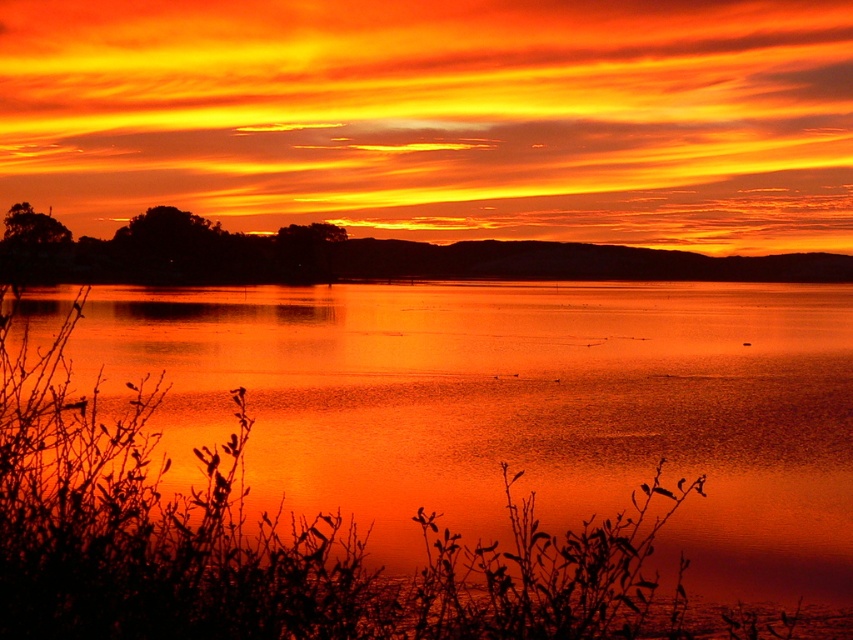
Question: In this image, where is matte orange water at center located relative to matte orange sky at center?

Choices:
 (A) right
 (B) left

Answer: (A)

Question: Is matte orange water at center closer to the viewer compared to matte orange sky at center?

Choices:
 (A) no
 (B) yes

Answer: (B)

Question: Among these points, which one is farthest from the camera?

Choices:
 (A) (134, 536)
 (B) (491, 248)

Answer: (B)

Question: Which of the following is the closest to the observer?

Choices:
 (A) matte orange sky at center
 (B) matte orange water at center

Answer: (B)

Question: Can you confirm if matte orange water at center is bigger than matte orange sky at center?

Choices:
 (A) no
 (B) yes

Answer: (A)